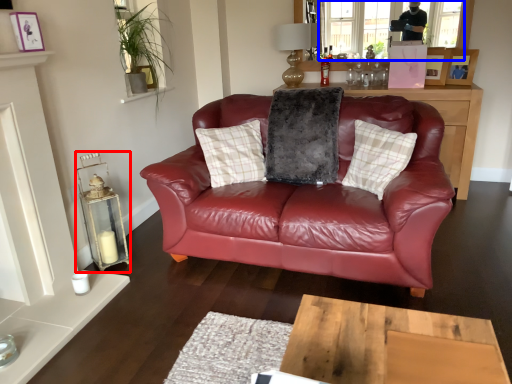
Question: Among these objects, which one is farthest to the camera, candle holder (highlighted by a red box) or window screen (highlighted by a blue box)?

Choices:
 (A) candle holder
 (B) window screen

Answer: (B)